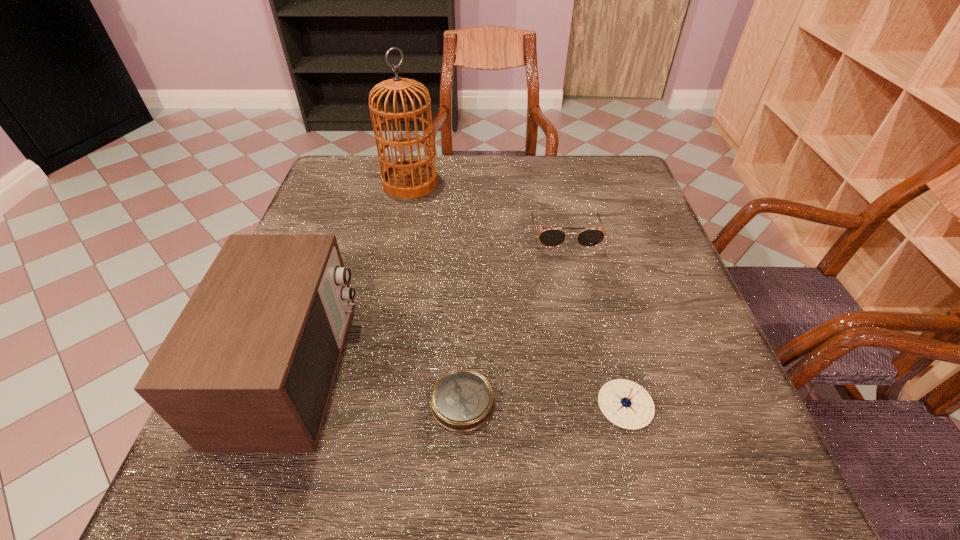
Locate an element on the screen. Image resolution: width=960 pixels, height=540 pixels. free space at the far edge is located at coordinates (564, 202).

In the image, there is a desktop. Where is `vacant space at the near edge`? The height and width of the screenshot is (540, 960). vacant space at the near edge is located at coordinates (506, 467).

Locate an element on the screen. The height and width of the screenshot is (540, 960). vacant space at the left edge is located at coordinates (348, 218).

At what (x,y) coordinates should I click in order to perform the action: click on free space at the right edge of the desktop. Please return your answer as a coordinate pair (x, y). This screenshot has width=960, height=540. Looking at the image, I should click on (688, 338).

Where is `free space between the shorter compass and the tallest object`? Image resolution: width=960 pixels, height=540 pixels. free space between the shorter compass and the tallest object is located at coordinates (437, 292).

Identify the location of empty location between the fourth tallest object and the tallest object. The height and width of the screenshot is (540, 960). (517, 294).

This screenshot has width=960, height=540. In order to click on free space between the sunglasses and the right compass in this screenshot , I will do `click(595, 320)`.

I want to click on free point between the second farthest object and the taller compass, so click(x=595, y=320).

I want to click on free space between the fourth tallest object and the shortest object, so click(x=544, y=403).

Find the location of a particular element. empty space between the right compass and the tallest object is located at coordinates (517, 294).